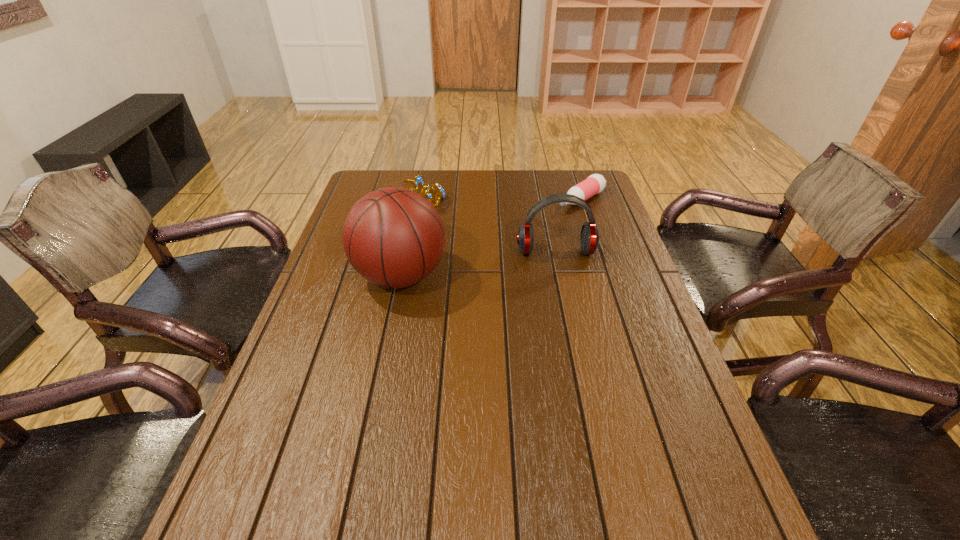
In the image, there is a desktop. Identify the location of vacant space at the far edge. point(511,185).

At what (x,y) coordinates should I click in order to perform the action: click on vacant space at the near edge of the desktop. Please return your answer as a coordinate pair (x, y). The height and width of the screenshot is (540, 960). Looking at the image, I should click on (610, 457).

Identify the location of vacant space at the left edge of the desktop. (351, 358).

This screenshot has width=960, height=540. I want to click on vacant region at the right edge of the desktop, so click(x=595, y=272).

In the image, there is a desktop. Where is `vacant region at the near left corner`? The height and width of the screenshot is (540, 960). vacant region at the near left corner is located at coordinates (323, 467).

Where is `free region at the near right corner`? free region at the near right corner is located at coordinates (658, 481).

Where is `free space between the shortest object and the tiara`? The height and width of the screenshot is (540, 960). free space between the shortest object and the tiara is located at coordinates (496, 199).

Identify the location of vacant point located between the tiara and the shortest object. The height and width of the screenshot is (540, 960). (496, 199).

This screenshot has width=960, height=540. Identify the location of free point between the third shortest object and the bottle. (568, 226).

I want to click on free point between the bottle and the earphone, so click(x=568, y=226).